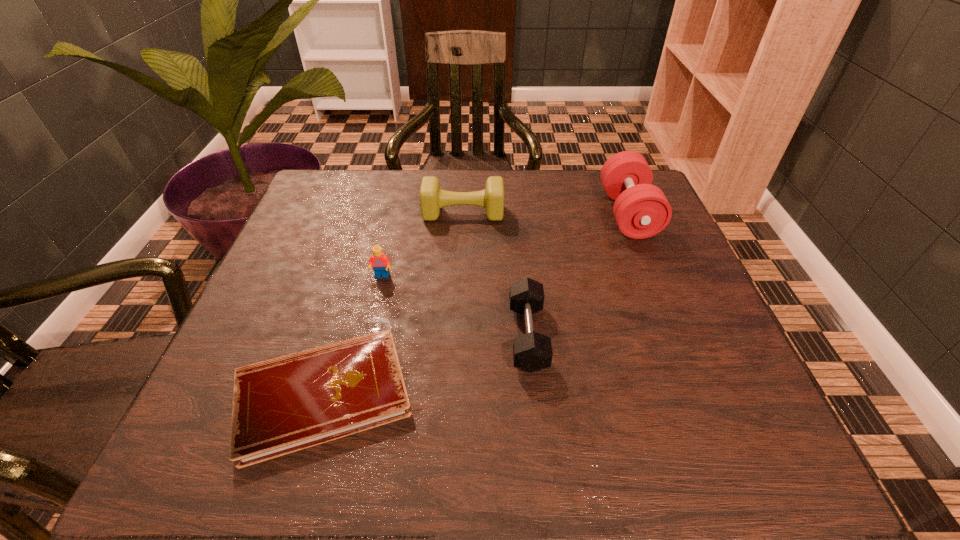
Where is `free spot at the far left corner of the desktop`? free spot at the far left corner of the desktop is located at coordinates (359, 214).

Locate an element on the screen. The height and width of the screenshot is (540, 960). free area in between the tallest dumbbell and the leftmost dumbbell is located at coordinates (545, 213).

Find the location of a particular element. The width and height of the screenshot is (960, 540). free point between the notebook and the third nearest object is located at coordinates (352, 335).

The height and width of the screenshot is (540, 960). Find the location of `free spot between the leftmost dumbbell and the second dumbbell from left to right`. free spot between the leftmost dumbbell and the second dumbbell from left to right is located at coordinates (495, 274).

Find the location of `vacant point located between the third farthest object and the shortest dumbbell`. vacant point located between the third farthest object and the shortest dumbbell is located at coordinates (455, 306).

The width and height of the screenshot is (960, 540). What are the coordinates of `free area in between the third nearest object and the notebook` in the screenshot? It's located at (352, 335).

Where is `free area in between the rightmost dumbbell and the shortest object`? This screenshot has width=960, height=540. free area in between the rightmost dumbbell and the shortest object is located at coordinates (475, 305).

Where is `vacant region between the third nearest object and the shortest dumbbell`? The height and width of the screenshot is (540, 960). vacant region between the third nearest object and the shortest dumbbell is located at coordinates (455, 306).

Locate an element on the screen. This screenshot has height=540, width=960. vacant area that lies between the Lego and the rightmost object is located at coordinates (505, 245).

At what (x,y) coordinates should I click in order to perform the action: click on free space between the Lego and the shortest object. Please return your answer as a coordinate pair (x, y). The image size is (960, 540). Looking at the image, I should click on (352, 335).